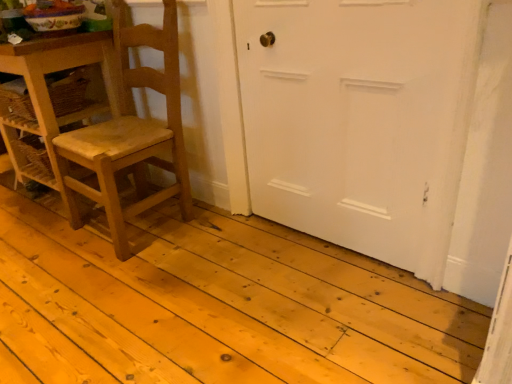
You are a GUI agent. You are given a task and a screenshot of the screen. Output one action in this format:
    pyautogui.click(x=<x>, y=<y>)
    Task: Click on the white matte door at center
    The width and height of the screenshot is (512, 384).
    Given the screenshot: What is the action you would take?
    pyautogui.click(x=359, y=119)

This screenshot has height=384, width=512. Describe the element at coordinates (214, 308) in the screenshot. I see `natural wood floor at center` at that location.

What do you see at coordinates (50, 99) in the screenshot? The image size is (512, 384). I see `wooden table at left` at bounding box center [50, 99].

Where is `wooden chair at left`? Image resolution: width=512 pixels, height=384 pixels. wooden chair at left is located at coordinates (133, 132).

Would you say wooden chair at left is inside or outside natural wood floor at center?

The correct answer is: outside.

Is wooden chair at left aimed at natural wood floor at center?

No, wooden chair at left is not aimed at natural wood floor at center.

Between wooden chair at left and natural wood floor at center, which one has larger size?

natural wood floor at center.

Considering the relative sizes of wooden chair at left and natural wood floor at center in the image provided, is wooden chair at left taller than natural wood floor at center?

Indeed, wooden chair at left has a greater height compared to natural wood floor at center.

Is white matte door at center with natural wood floor at center?

There is a gap between white matte door at center and natural wood floor at center.

Does white matte door at center lie in front of natural wood floor at center?

That is False.

From a real-world perspective, relative to natural wood floor at center, is white matte door at center vertically above or below?

white matte door at center is situated higher than natural wood floor at center in the real world.

Based on the photo, does white matte door at center have a greater height compared to natural wood floor at center?

Yes, white matte door at center is taller than natural wood floor at center.

Is there a large distance between white matte door at center and wooden table at left?

Indeed, white matte door at center is not near wooden table at left.

From the image's perspective, between white matte door at center and wooden table at left, who is located below?

white matte door at center.

From a real-world perspective, is white matte door at center physically located above or below wooden table at left?

white matte door at center is situated higher than wooden table at left in the real world.

From the image's perspective, is wooden chair at left positioned above or below wooden table at left?

wooden chair at left is situated lower than wooden table at left in the image.

Is wooden chair at left turned away from wooden table at left?

No, wooden chair at left is not facing away from wooden table at left.

Would you say wooden chair at left is inside or outside wooden table at left?

wooden chair at left lies outside wooden table at left.

Considering the sizes of objects natural wood floor at center and white matte door at center in the image provided, who is smaller, natural wood floor at center or white matte door at center?

With smaller size is white matte door at center.

Consider the image. Based on their positions, is natural wood floor at center located to the left or right of white matte door at center?

natural wood floor at center is to the left of white matte door at center.

Looking at this image, from the image's perspective, which is below, natural wood floor at center or white matte door at center?

natural wood floor at center appears lower in the image.

What's the angular difference between natural wood floor at center and white matte door at center's facing directions?

The angle between the facing direction of natural wood floor at center and the facing direction of white matte door at center is 180 degrees.

Where is `door positioned vertically above the wooden table at left (from a real-world perspective)`? The image size is (512, 384). door positioned vertically above the wooden table at left (from a real-world perspective) is located at coordinates (359, 119).

Could you tell me if wooden table at left is facing white matte door at center?

No, wooden table at left does not turn towards white matte door at center.

Considering the positions of objects wooden table at left and white matte door at center in the image provided, who is more to the right, wooden table at left or white matte door at center?

white matte door at center is more to the right.

Is wooden table at left touching white matte door at center?

wooden table at left and white matte door at center are not in contact.

Is natural wood floor at center touching wooden table at left?

No, natural wood floor at center is not beside wooden table at left.

How many degrees apart are the facing directions of natural wood floor at center and wooden table at left?

180 degrees separate the facing orientations of natural wood floor at center and wooden table at left.

Which of these two, natural wood floor at center or wooden table at left, stands shorter?

natural wood floor at center is shorter.

Is natural wood floor at center positioned with its back to wooden table at left?

No, natural wood floor at center is not facing away from wooden table at left.

At what (x,y) coordinates should I click in order to perform the action: click on chair above the natural wood floor at center (from a real-world perspective). Please return your answer as a coordinate pair (x, y). Looking at the image, I should click on (133, 132).

I want to click on plank below the white matte door at center (from the image's perspective), so click(x=214, y=308).

When comparing their distances from wooden table at left, does wooden chair at left or white matte door at center seem further?

white matte door at center is further to wooden table at left.

Looking at the image, which one is located closer to white matte door at center, wooden table at left or wooden chair at left?

The object closer to white matte door at center is wooden chair at left.

Considering their positions, is white matte door at center positioned closer to wooden table at left than wooden chair at left?

Based on the image, wooden chair at left appears to be nearer to wooden table at left.

Based on their spatial positions, is wooden table at left or natural wood floor at center further from white matte door at center?

wooden table at left is positioned further to the anchor white matte door at center.

Considering their positions, is natural wood floor at center positioned closer to wooden chair at left than white matte door at center?

natural wood floor at center lies closer to wooden chair at left than the other object.

Considering their positions, is white matte door at center positioned closer to natural wood floor at center than wooden table at left?

white matte door at center.

From the image, which object appears to be nearer to white matte door at center, natural wood floor at center or wooden chair at left?

natural wood floor at center lies closer to white matte door at center than the other object.

Based on their spatial positions, is wooden table at left or white matte door at center further from natural wood floor at center?

wooden table at left is positioned further to the anchor natural wood floor at center.

Find the location of a particular element. This screenshot has height=384, width=512. chair between wooden table at left and white matte door at center is located at coordinates (133, 132).

Where is `chair situated between natural wood floor at center and white matte door at center from left to right`? The height and width of the screenshot is (384, 512). chair situated between natural wood floor at center and white matte door at center from left to right is located at coordinates (133, 132).

Find the location of a particular element. Image resolution: width=512 pixels, height=384 pixels. plank situated between wooden table at left and white matte door at center from left to right is located at coordinates (214, 308).

You are a GUI agent. You are given a task and a screenshot of the screen. Output one action in this format:
    pyautogui.click(x=<x>, y=<y>)
    Task: Click on the chair between natural wood floor at center and wooden table at left in the front-back direction
    Image resolution: width=512 pixels, height=384 pixels.
    Given the screenshot: What is the action you would take?
    pyautogui.click(x=133, y=132)